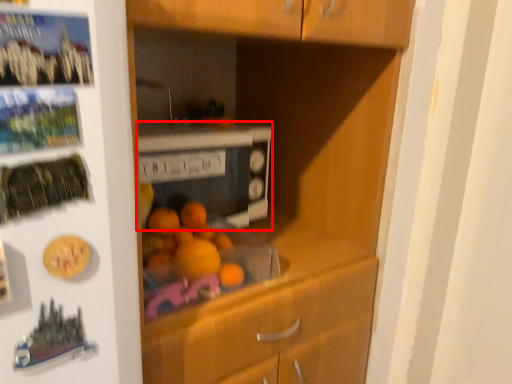
Question: Where is home appliance (annotated by the red box) located in relation to button in the image?

Choices:
 (A) right
 (B) left

Answer: (A)